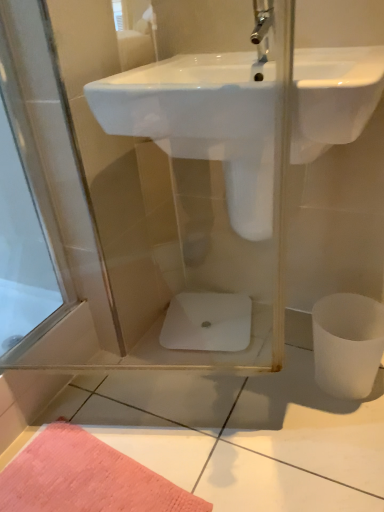
Question: Is white matte toilet bowl at lower right, which ranks as the 1th toilet bowl in right-to-left order, wider than white glossy sink at center?

Choices:
 (A) yes
 (B) no

Answer: (B)

Question: Does white matte toilet bowl at lower right, which ranks as the 1th toilet bowl in right-to-left order, contain white glossy sink at center?

Choices:
 (A) yes
 (B) no

Answer: (B)

Question: From a real-world perspective, is white matte toilet bowl at lower right, marked as the 2th toilet bowl in a back-to-front arrangement, located beneath white glossy sink at center?

Choices:
 (A) yes
 (B) no

Answer: (A)

Question: Is white matte toilet bowl at lower right, which ranks as the 1th toilet bowl in right-to-left order, positioned behind white glossy sink at center?

Choices:
 (A) yes
 (B) no

Answer: (A)

Question: Is white matte toilet bowl at lower right, which ranks as the 1th toilet bowl in right-to-left order, taller than white glossy sink at center?

Choices:
 (A) yes
 (B) no

Answer: (A)

Question: Is white matte toilet bowl at lower right, marked as the 2th toilet bowl in a back-to-front arrangement, facing towards white glossy sink at center?

Choices:
 (A) no
 (B) yes

Answer: (A)

Question: From the image's perspective, is white glossy toilet bowl at center, marked as the 2th toilet bowl in a front-to-back arrangement, beneath white glossy sink at center?

Choices:
 (A) yes
 (B) no

Answer: (A)

Question: Is white glossy toilet bowl at center, the first toilet bowl when ordered from back to front, positioned beyond the bounds of white glossy sink at center?

Choices:
 (A) no
 (B) yes

Answer: (B)

Question: From the image's perspective, is white glossy toilet bowl at center, which is counted as the 2th toilet bowl, starting from the right, on white glossy sink at center?

Choices:
 (A) no
 (B) yes

Answer: (A)

Question: Considering the relative sizes of white glossy toilet bowl at center, the first toilet bowl in the left-to-right sequence, and white glossy sink at center in the image provided, is white glossy toilet bowl at center, the first toilet bowl in the left-to-right sequence, bigger than white glossy sink at center?

Choices:
 (A) yes
 (B) no

Answer: (B)

Question: Are white glossy toilet bowl at center, the first toilet bowl when ordered from back to front, and white glossy sink at center located far from each other?

Choices:
 (A) no
 (B) yes

Answer: (A)

Question: Are white glossy toilet bowl at center, the first toilet bowl in the left-to-right sequence, and white glossy sink at center making contact?

Choices:
 (A) yes
 (B) no

Answer: (B)

Question: Is white glossy toilet bowl at center, which is counted as the 2th toilet bowl, starting from the right, turned away from white matte toilet bowl at lower right, the second toilet bowl when ordered from left to right?

Choices:
 (A) no
 (B) yes

Answer: (A)